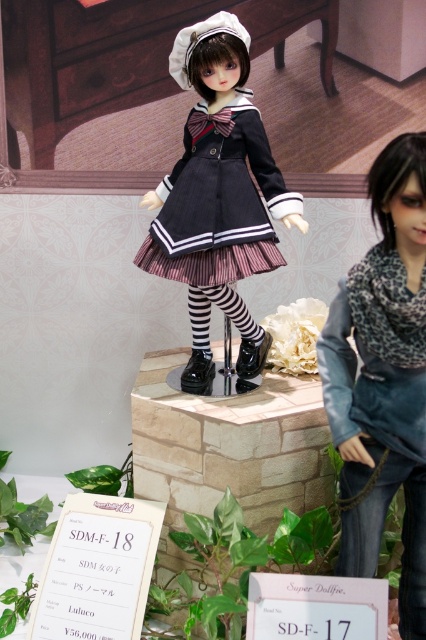
Is point (339, 428) positioned in front of point (264, 189)?

Yes, point (339, 428) is in front of point (264, 189).

Who is more distant from viewer, (405, 570) or (167, 177)?

The point (167, 177) is behind.

Does point (391, 371) lie in front of point (160, 184)?

Yes.

Identify the location of leopard print scarf at right. This screenshot has height=640, width=426. (383, 380).

At what (x,y) coordinates should I click in order to perform the action: click on matte black dress at center. Please return your answer as a coordinate pair (x, y). The height and width of the screenshot is (640, 426). Looking at the image, I should click on (218, 196).

Is leopard print scarf at right in front of satin-like black dress at center?

Yes, leopard print scarf at right is in front of satin-like black dress at center.

Who is more forward, (362,557) or (186,131)?

Point (362,557)

What do you see at coordinates (383, 380) in the screenshot? I see `leopard print scarf at right` at bounding box center [383, 380].

Identify the location of leopard print scarf at right. Image resolution: width=426 pixels, height=640 pixels. (383, 380).